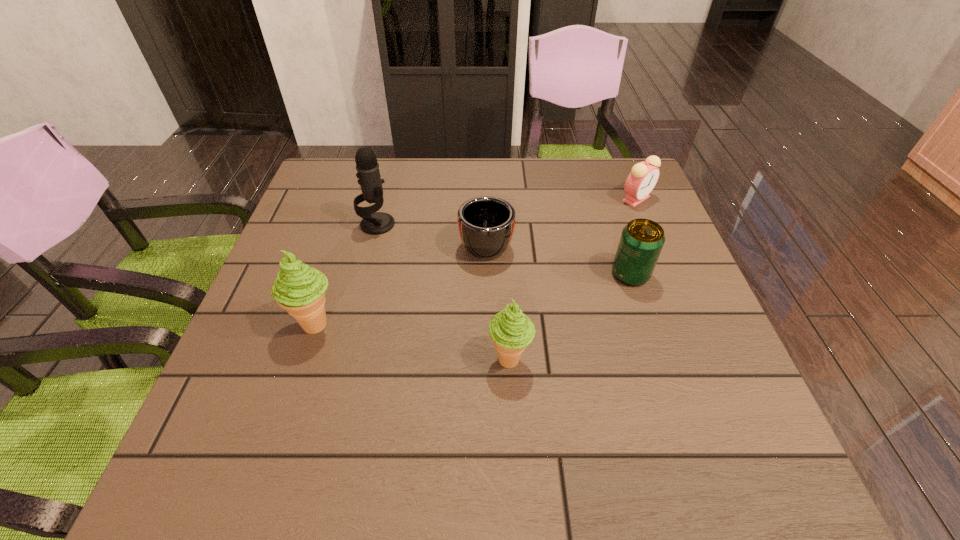
This screenshot has height=540, width=960. I want to click on the taller icecream, so click(299, 289).

Identify the location of the third tallest object. This screenshot has height=540, width=960. coord(510,330).

I want to click on the right icecream, so click(x=510, y=330).

At what (x,y) coordinates should I click in order to perform the action: click on mug. Please return your answer as a coordinate pair (x, y). Looking at the image, I should click on (486, 224).

This screenshot has width=960, height=540. What are the coordinates of `microphone` in the screenshot? It's located at click(368, 173).

Where is `the farthest object`? the farthest object is located at coordinates coord(643,177).

Locate an element on the screen. The height and width of the screenshot is (540, 960). beer can is located at coordinates (641, 241).

Identify the location of blank space located 0.400m on the right of the left icecream. pyautogui.click(x=536, y=324).

Identify the location of free space located on the right of the right icecream. (656, 359).

Locate an element on the screen. The height and width of the screenshot is (540, 960). free point located 0.190m on the side of the mug with the handle is located at coordinates [485, 177].